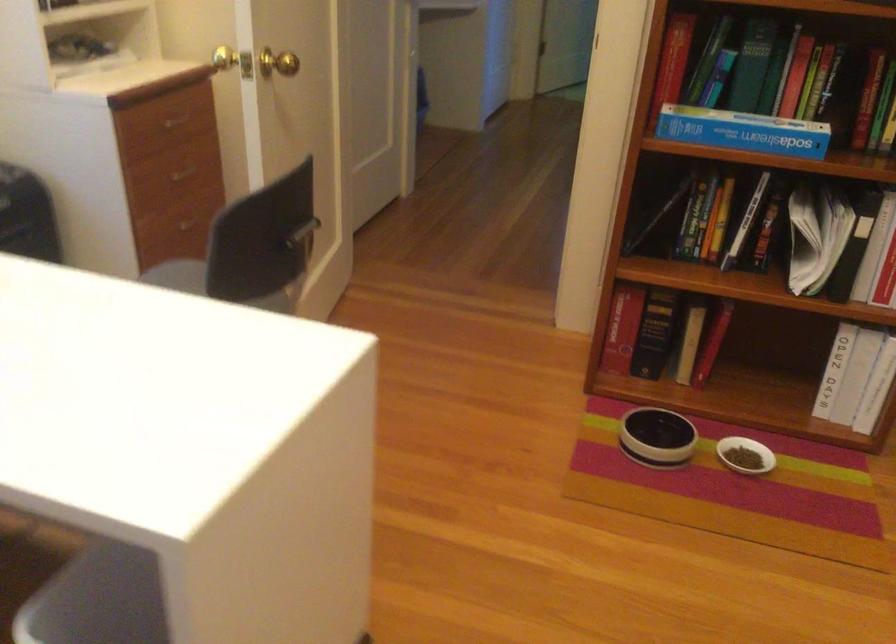
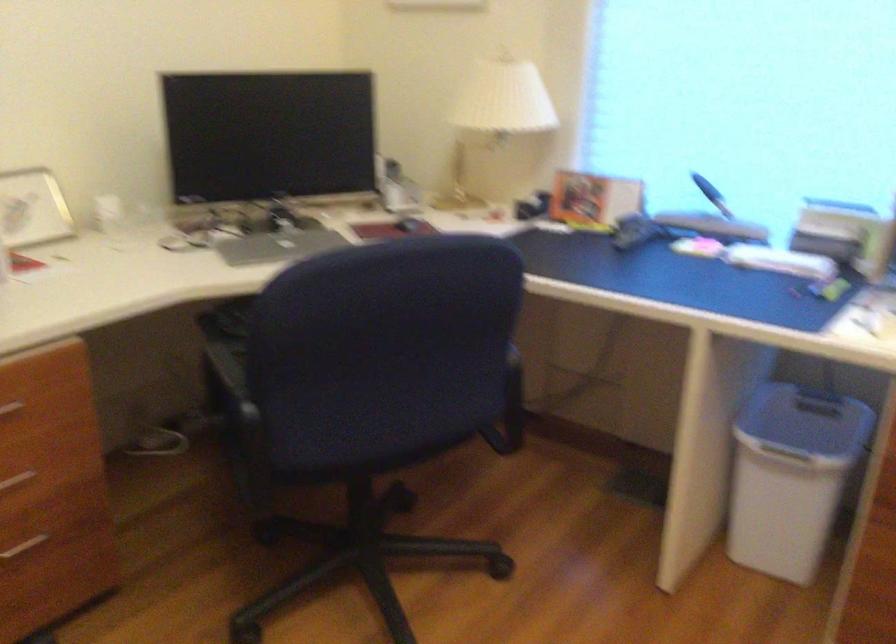
First-person continuous shooting, in which direction is the camera rotating?

The camera rotated toward left-down.